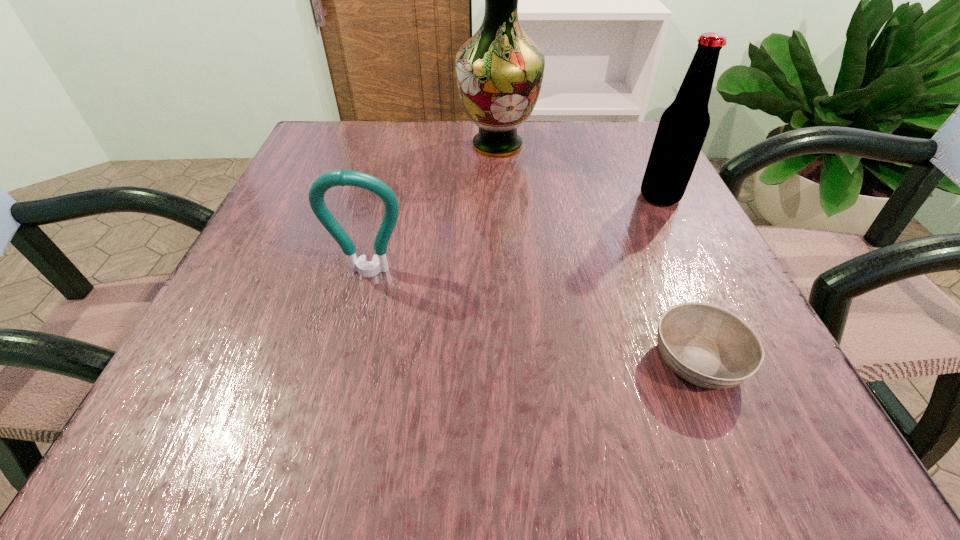
I want to click on vase, so click(499, 71).

Locate an element on the screen. the farthest object is located at coordinates (499, 71).

Image resolution: width=960 pixels, height=540 pixels. What are the coordinates of `the third nearest object` in the screenshot? It's located at (683, 126).

You are a GUI agent. You are given a task and a screenshot of the screen. Output one action in this format:
    pyautogui.click(x=<x>, y=<y>)
    Task: Click on the third shortest object
    
    Given the screenshot: What is the action you would take?
    pyautogui.click(x=683, y=126)

Locate an element on the screen. This screenshot has height=540, width=960. the third farthest object is located at coordinates (341, 177).

Image resolution: width=960 pixels, height=540 pixels. What are the coordinates of `the leftmost object` in the screenshot? It's located at (341, 177).

I want to click on the shortest object, so click(708, 346).

At what (x,y) coordinates should I click in order to perform the action: click on the nearest object. Please return your answer as a coordinate pair (x, y). The width and height of the screenshot is (960, 540). Looking at the image, I should click on (708, 346).

You are a GUI agent. You are given a task and a screenshot of the screen. Output one action in this format:
    pyautogui.click(x=<x>, y=<y>)
    Task: Click on the free space located on the front of the second object from left to right
    
    Given the screenshot: What is the action you would take?
    pyautogui.click(x=506, y=289)

Locate an element on the screen. This screenshot has width=960, height=540. free region located 0.100m on the back of the second tallest object is located at coordinates (641, 159).